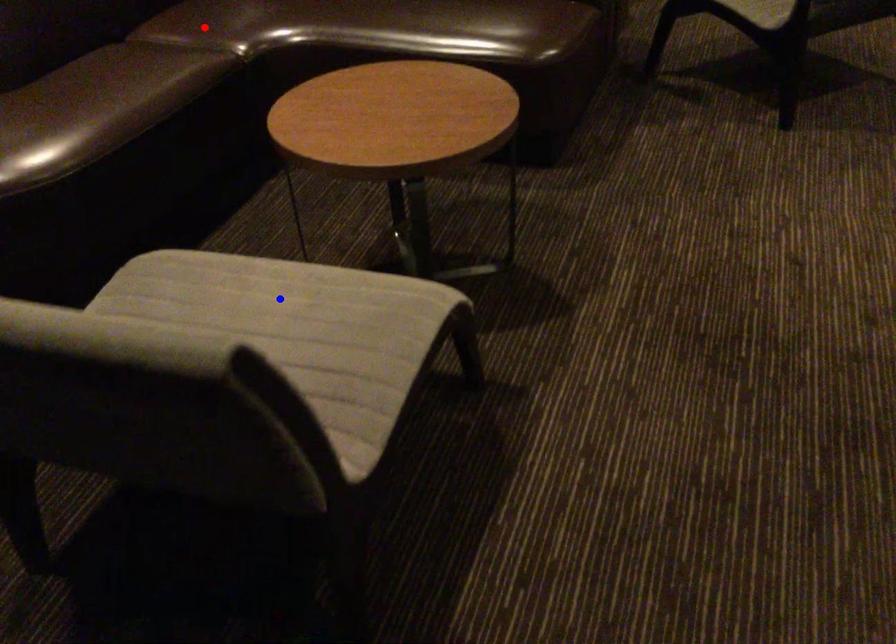
Question: Two points are marked on the image. Which point is closer to the camera?

Choices:
 (A) Blue point is closer.
 (B) Red point is closer.

Answer: (A)